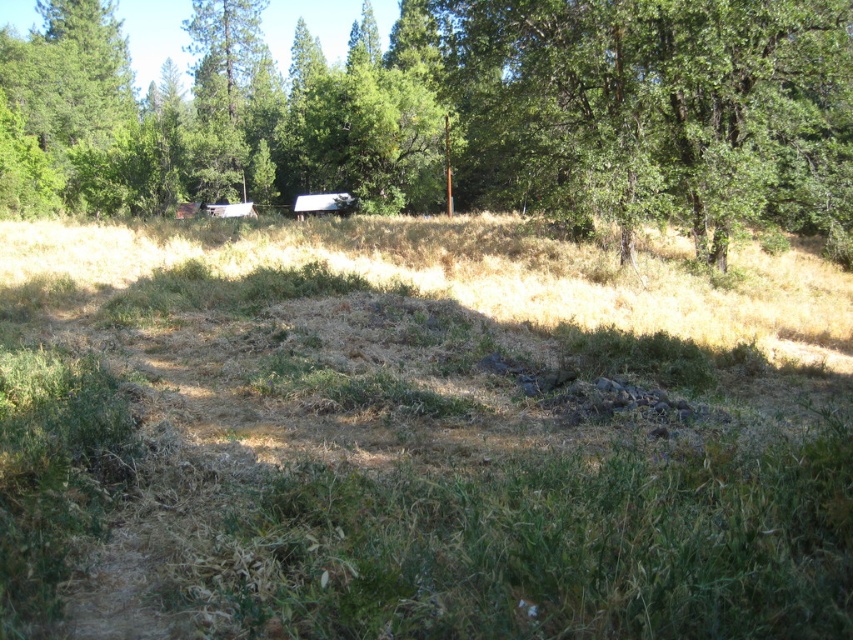
You are standing in the middle of the green grass at center and want to reach the green leafy tree at upper center. Which direction should you walk to get closer to the tree?

The green grass at center is smaller than the green leafy tree at upper center, so you should walk towards the upper direction to get closer to the tree.

You are a gardener planning to plant flowers in the green grass at center. Considering the presence of the green leafy tree at upper center, will the flowers receive enough sunlight?

The green grass at center is positioned under the green leafy tree at upper center, which may block sunlight, so the flowers might not receive enough sunlight.

You are standing in the middle of a field and see a point marked at coordinates (416,433). What is the color of the vegetation at that point?

The point at (416,433) marks green grass at center.